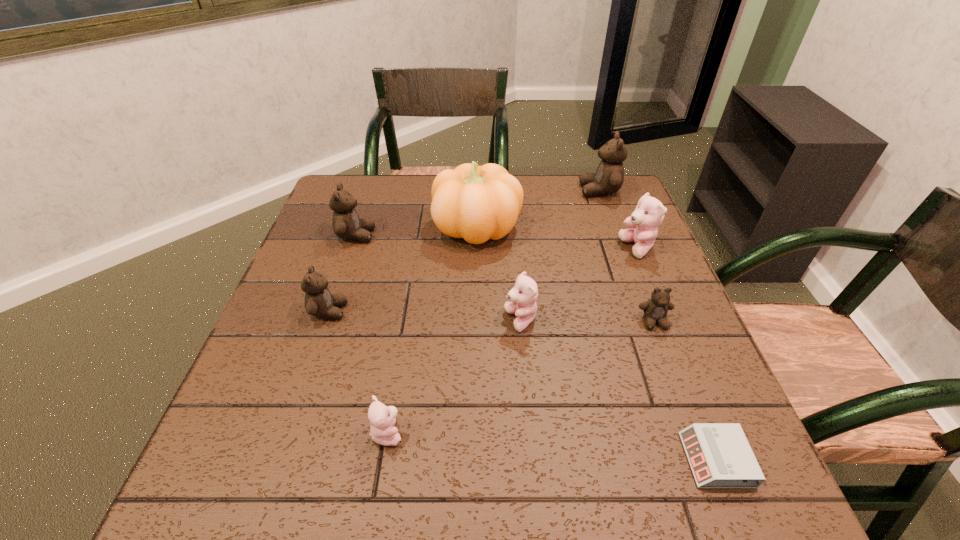
Where is `free space at the near right corner of the desktop`? free space at the near right corner of the desktop is located at coordinates (718, 512).

Where is `free area in between the pumpkin and the third smallest brown teddy bear`? The width and height of the screenshot is (960, 540). free area in between the pumpkin and the third smallest brown teddy bear is located at coordinates click(417, 231).

Image resolution: width=960 pixels, height=540 pixels. In order to click on free space between the nearest pink teddy bear and the third nearest brown teddy bear in this screenshot , I will do `click(372, 334)`.

Locate an element on the screen. free point between the leftmost pink teddy bear and the farthest brown teddy bear is located at coordinates (493, 312).

The width and height of the screenshot is (960, 540). I want to click on vacant space that's between the third biggest brown teddy bear and the alarm clock, so click(522, 385).

Find the location of a particular element. blank region between the pumpkin and the nearest pink teddy bear is located at coordinates (433, 329).

Find the location of a particular element. The image size is (960, 540). free space between the biggest brown teddy bear and the third biggest brown teddy bear is located at coordinates (464, 251).

Where is `vacant area that lies between the pumpkin and the alarm clock`? vacant area that lies between the pumpkin and the alarm clock is located at coordinates (597, 343).

Locate an element on the screen. free area in between the shortest object and the fifth teddy bear from right to left is located at coordinates (552, 446).

Where is `free space between the alarm clock and the pumpkin`? The image size is (960, 540). free space between the alarm clock and the pumpkin is located at coordinates (597, 343).